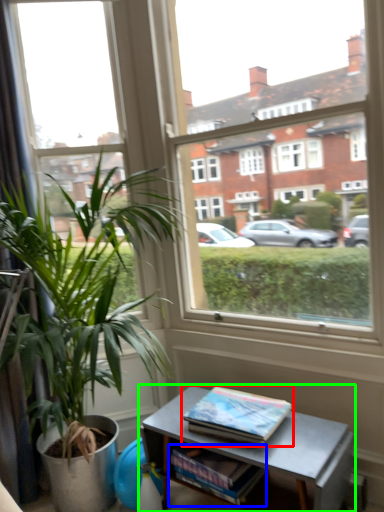
Question: Estimate the real-world distances between objects in this image. Which object is closer to book (highlighted by a red box), magazine (highlighted by a blue box) or table (highlighted by a green box)?

Choices:
 (A) magazine
 (B) table

Answer: (B)